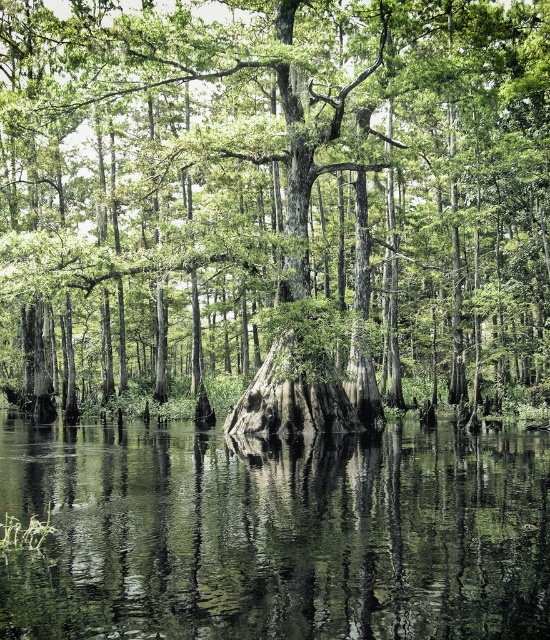
Measure the distance between smooth bark tree at center and green reflective water at center.

smooth bark tree at center and green reflective water at center are 21.00 meters apart.

Is point (458, 220) closer to viewer compared to point (212, 492)?

No, (458, 220) is further to viewer.

The height and width of the screenshot is (640, 550). I want to click on smooth bark tree at center, so click(276, 200).